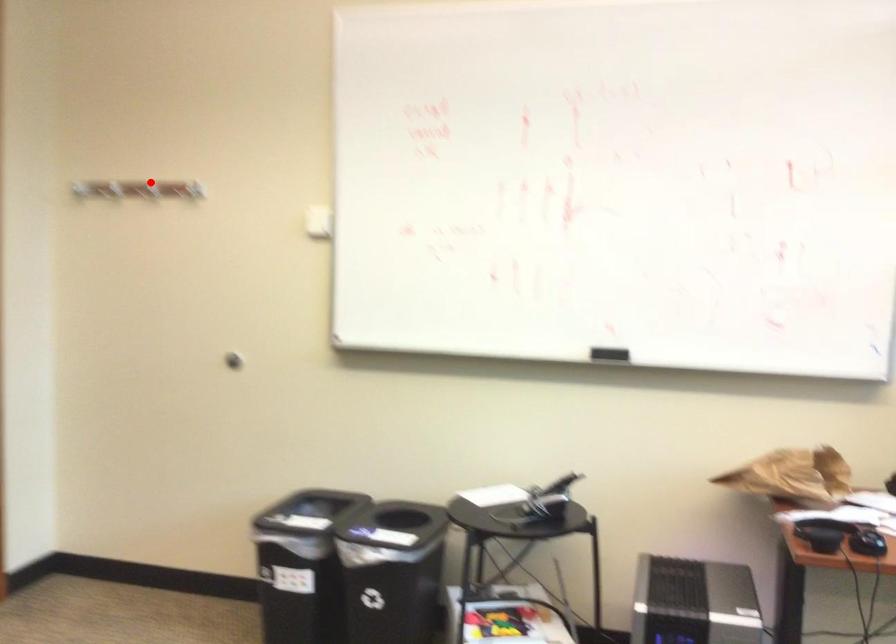
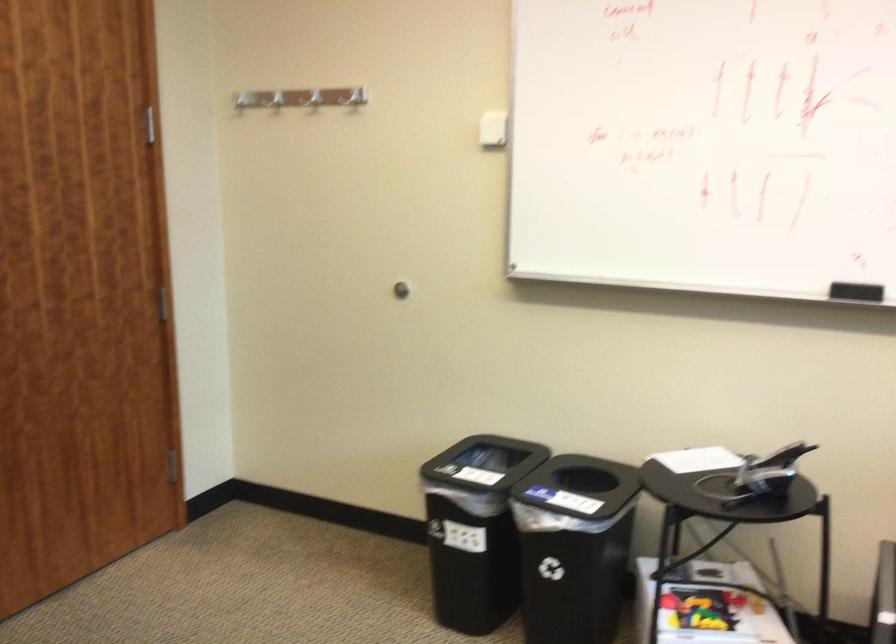
Where in the second image is the point corresponding to the highlighted location from the first image?

(313, 98)